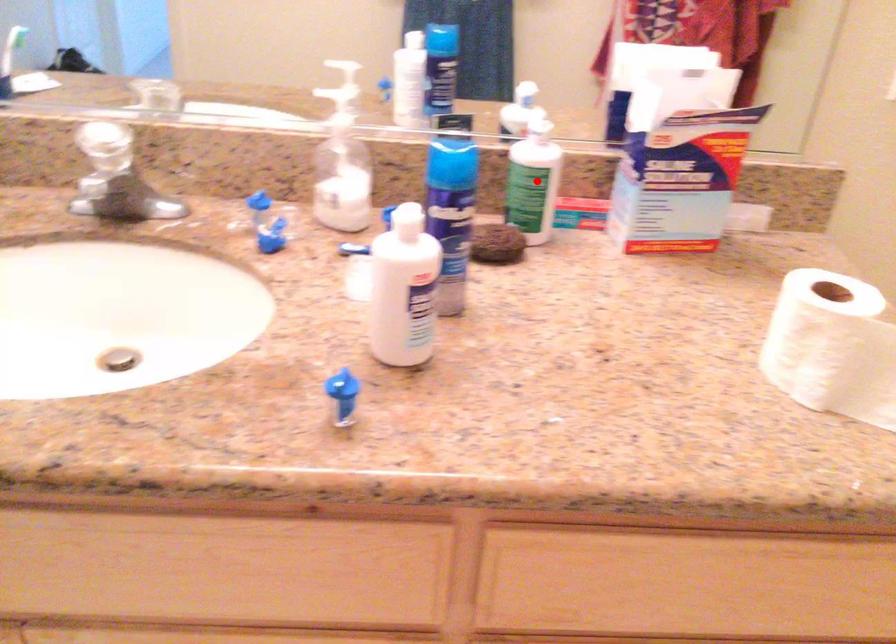
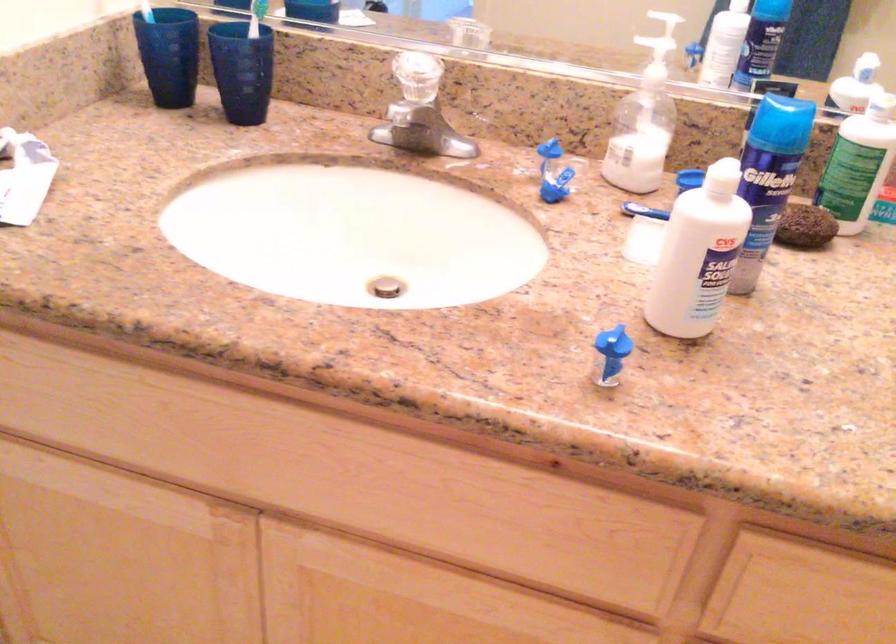
Where in the second image is the point corresponding to the highlighted location from the first image?

(858, 164)